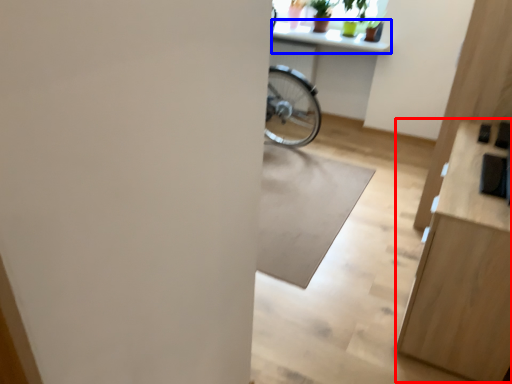
Question: Among these objects, which one is nearest to the camera, dresser (highlighted by a red box) or counter top (highlighted by a blue box)?

Choices:
 (A) dresser
 (B) counter top

Answer: (A)